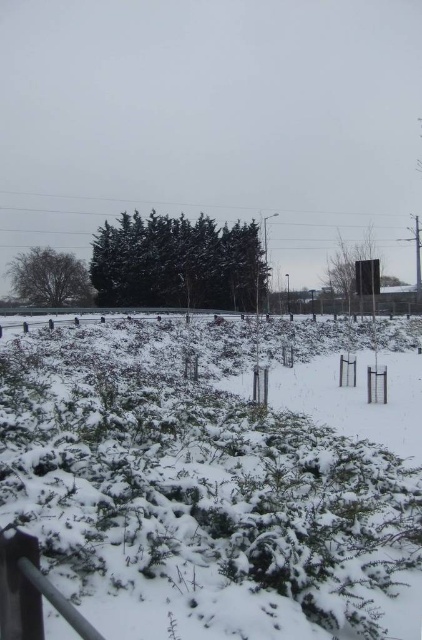
Question: Is white fluffy snow at center positioned at the back of snow-covered evergreen tree at center?

Choices:
 (A) yes
 (B) no

Answer: (B)

Question: Does snow-covered evergreen tree at center have a greater width compared to green matte tree at left?

Choices:
 (A) no
 (B) yes

Answer: (B)

Question: Which point is closer to the camera taking this photo?

Choices:
 (A) (280, 321)
 (B) (227, 291)

Answer: (A)

Question: Is the position of snow-covered evergreen tree at center less distant than that of green matte tree at left?

Choices:
 (A) yes
 (B) no

Answer: (A)

Question: Estimate the real-world distances between objects in this image. Which object is closer to the green matte tree at left?

Choices:
 (A) snow-covered evergreen tree at center
 (B) white fluffy snow at center

Answer: (A)

Question: Among these points, which one is farthest from the camera?

Choices:
 (A) (67, 280)
 (B) (186, 253)

Answer: (A)